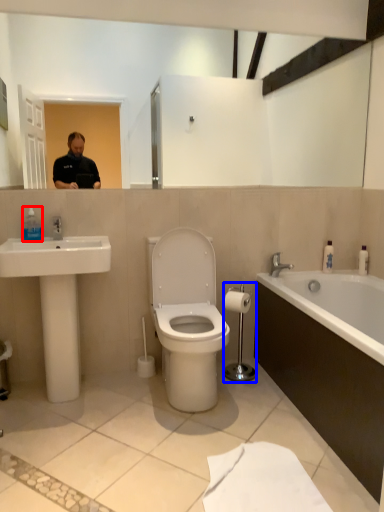
Question: Which object is further to the camera taking this photo, soap dispenser (highlighted by a red box) or towel bar (highlighted by a blue box)?

Choices:
 (A) soap dispenser
 (B) towel bar

Answer: (B)